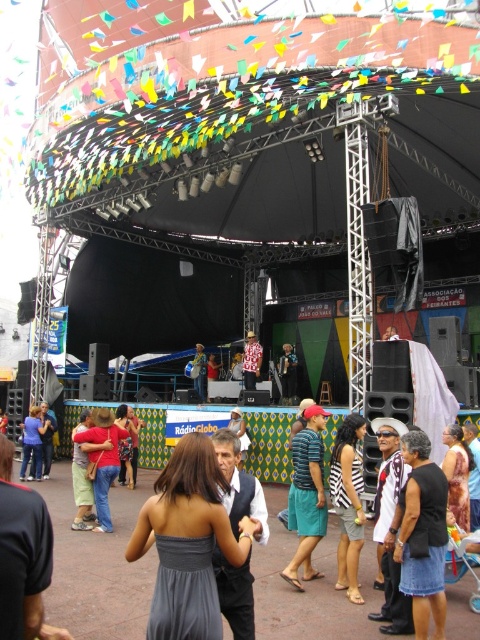
You are a photographer at the event and want to capture a photo of the matte black vest at center and the green fabric dress at center. Which clothing item will appear larger in the photo?

The matte black vest at center will appear larger in the photo because it is much taller than the green fabric dress at center.

You are at the lively outdoor event and want to take a photo of the stage. There are two points marked in the image. One is at coordinates point (465, 497) and the other is at point (200, 352). Which point should you stand at to ensure the stage is fully visible without any obstruction?

You should stand at point (200, 352) because point (465, 497) is in front of it, meaning standing there might block the view of the stage.

You are at the lively outdoor event and want to take a photo of the brown textured dress at lower right. If your camera has a maximum focus range of 30 meters, will you be able to capture a clear photo?

The brown textured dress at lower right is 30.36 meters away from the viewer. Since the camera can only focus up to 30 meters, it won t be able to capture a clear photo.